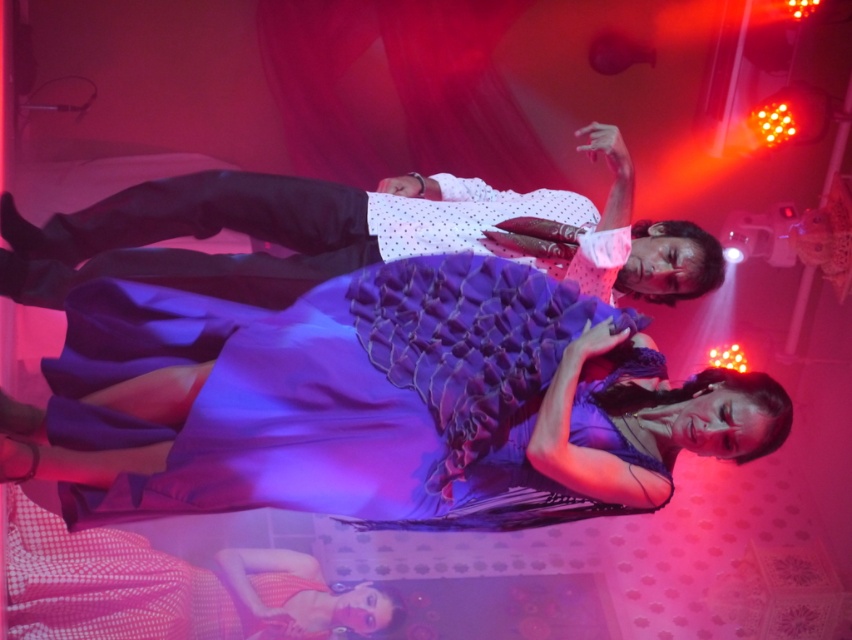
Question: Observing the image, what is the correct spatial positioning of purple tulle dress at center in reference to matte white shirt at upper center?

Choices:
 (A) right
 (B) left

Answer: (A)

Question: Does purple tulle dress at center appear over matte white shirt at upper center?

Choices:
 (A) no
 (B) yes

Answer: (A)

Question: Does purple tulle dress at center have a lesser width compared to matte white shirt at upper center?

Choices:
 (A) no
 (B) yes

Answer: (B)

Question: Which object is farther from the camera taking this photo?

Choices:
 (A) purple tulle dress at center
 (B) matte white shirt at upper center

Answer: (B)